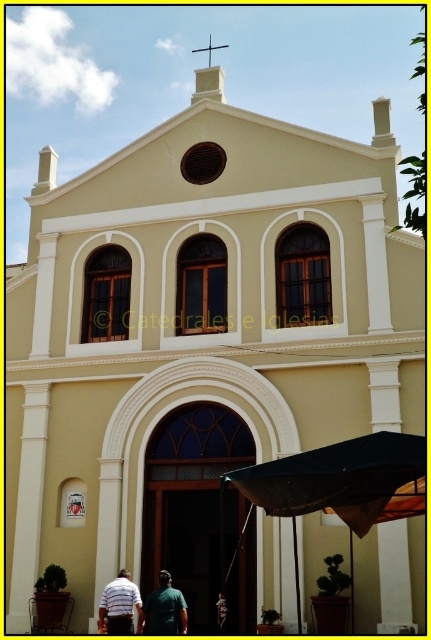
You are standing in front of the church and see the dark fabric umbrella at lower center. Where is the dark fabric umbrella located relative to the central window?

The dark fabric umbrella at lower center is located at the coordinates point (340, 483), which is to the right of the central window.

You are standing in front of the church and see both the dark fabric umbrella at lower center and the striped shirt at lower center. Which object takes up more space in the image?

The dark fabric umbrella at lower center is larger in size than the striped shirt at lower center, so it takes up more space in the image.

You are standing in front of the church and notice a dark fabric umbrella at lower center and a striped shirt at lower center. Which object is wider?

The dark fabric umbrella at lower center is wider than the striped shirt at lower center according to the description provided.